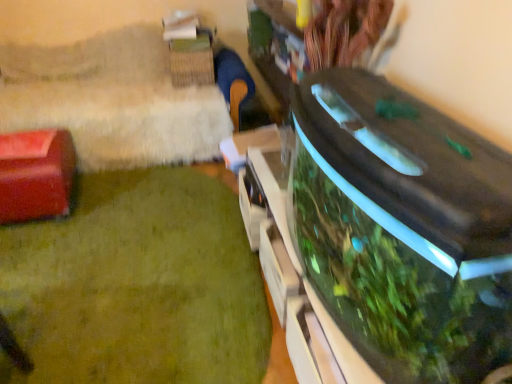
Question: Is green glossy aquarium at lower right facing towards matte red box at left?

Choices:
 (A) yes
 (B) no

Answer: (B)

Question: Considering the relative sizes of green glossy aquarium at lower right and matte red box at left in the image provided, is green glossy aquarium at lower right taller than matte red box at left?

Choices:
 (A) no
 (B) yes

Answer: (A)

Question: Does green glossy aquarium at lower right have a greater width compared to matte red box at left?

Choices:
 (A) yes
 (B) no

Answer: (A)

Question: Is green glossy aquarium at lower right turned away from matte red box at left?

Choices:
 (A) no
 (B) yes

Answer: (A)

Question: Are green glossy aquarium at lower right and matte red box at left far apart?

Choices:
 (A) yes
 (B) no

Answer: (B)

Question: Is matte red box at left taller or shorter than transparent glass aquarium at right?

Choices:
 (A) short
 (B) tall

Answer: (B)

Question: Looking at their shapes, would you say matte red box at left is wider or thinner than transparent glass aquarium at right?

Choices:
 (A) thin
 (B) wide

Answer: (B)

Question: Considering their positions, is matte red box at left located in front of or behind transparent glass aquarium at right?

Choices:
 (A) behind
 (B) front

Answer: (A)

Question: From a real-world perspective, relative to transparent glass aquarium at right, is matte red box at left vertically above or below?

Choices:
 (A) below
 (B) above

Answer: (B)

Question: From a real-world perspective, is matte red box at left positioned above or below green glossy aquarium at lower right?

Choices:
 (A) below
 (B) above

Answer: (B)

Question: Considering the relative positions of matte red box at left and green glossy aquarium at lower right in the image provided, is matte red box at left to the left or to the right of green glossy aquarium at lower right?

Choices:
 (A) left
 (B) right

Answer: (A)

Question: Is point (51, 192) positioned closer to the camera than point (112, 299)?

Choices:
 (A) closer
 (B) farther

Answer: (B)

Question: Based on their sizes in the image, would you say matte red box at left is bigger or smaller than green glossy aquarium at lower right?

Choices:
 (A) big
 (B) small

Answer: (B)

Question: Is point (148, 256) positioned closer to the camera than point (327, 185)?

Choices:
 (A) farther
 (B) closer

Answer: (B)

Question: In the image, is green glossy aquarium at lower right positioned in front of or behind transparent glass aquarium at right?

Choices:
 (A) behind
 (B) front

Answer: (A)